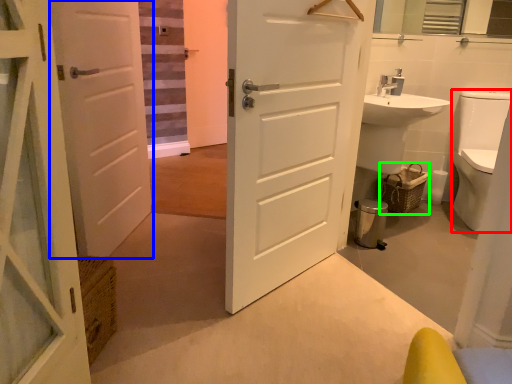
Question: Estimate the real-world distances between objects in this image. Which object is farther from toilet bowl (highlighted by a red box), door (highlighted by a blue box) or basket (highlighted by a green box)?

Choices:
 (A) door
 (B) basket

Answer: (A)